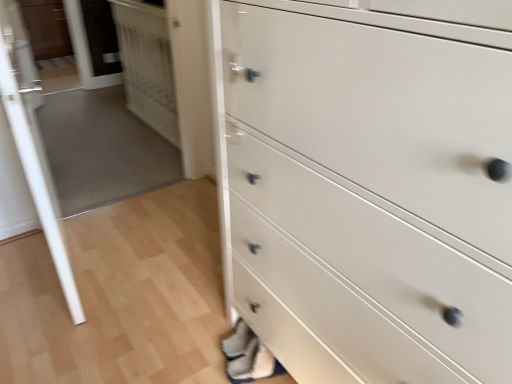
Question: Considering the positions of point tap(128, 21) and point tap(27, 31), is point tap(128, 21) closer or farther from the camera than point tap(27, 31)?

Choices:
 (A) farther
 (B) closer

Answer: (B)

Question: Is transparent glass door at upper left, the 1th glass door from the back, taller or shorter than matte brown cabinet at upper left?

Choices:
 (A) tall
 (B) short

Answer: (A)

Question: Considering the real-world distances, which object is closest to the white glossy door at upper left?

Choices:
 (A) transparent glass door at left, which appears as the 2th glass door when viewed from the back
 (B) white glossy chest of drawers at lower right
 (C) transparent glass door at upper left, positioned as the 2th glass door in front-to-back order
 (D) matte brown cabinet at upper left

Answer: (C)

Question: Which object is the closest to the white glossy chest of drawers at lower right?

Choices:
 (A) matte brown cabinet at upper left
 (B) transparent glass door at left, the first glass door viewed from the front
 (C) white glossy door at upper left
 (D) transparent glass door at upper left, the 1th glass door from the back

Answer: (B)